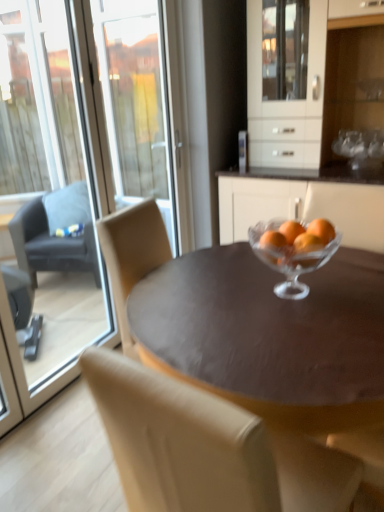
Question: From a real-world perspective, is dark gray fabric chair at left, the 2th chair positioned from the front, positioned above or below orangesmooth glassbowl at center?

Choices:
 (A) above
 (B) below

Answer: (B)

Question: Does point (84, 239) appear closer or farther from the camera than point (322, 241)?

Choices:
 (A) closer
 (B) farther

Answer: (B)

Question: Which of these objects is positioned closest to the matte brown table at center?

Choices:
 (A) transparent glass screen door at upper left
 (B) clear glass bowl at center
 (C) white glossy cabinet at upper center
 (D) beige leather chair at center, placed as the 1th chair when sorted from right to left
 (E) dark gray fabric chair at left, the 2th chair positioned from the front

Answer: (B)

Question: Estimate the real-world distances between objects in this image. Which object is farther from the matte brown table at center?

Choices:
 (A) transparent glass screen door at upper left
 (B) white glossy cabinet at upper center
 (C) clear glass bowl at center
 (D) beige leather chair at center, arranged as the 1th chair when ordered from the bottom
 (E) orangesmooth glassbowl at center

Answer: (A)